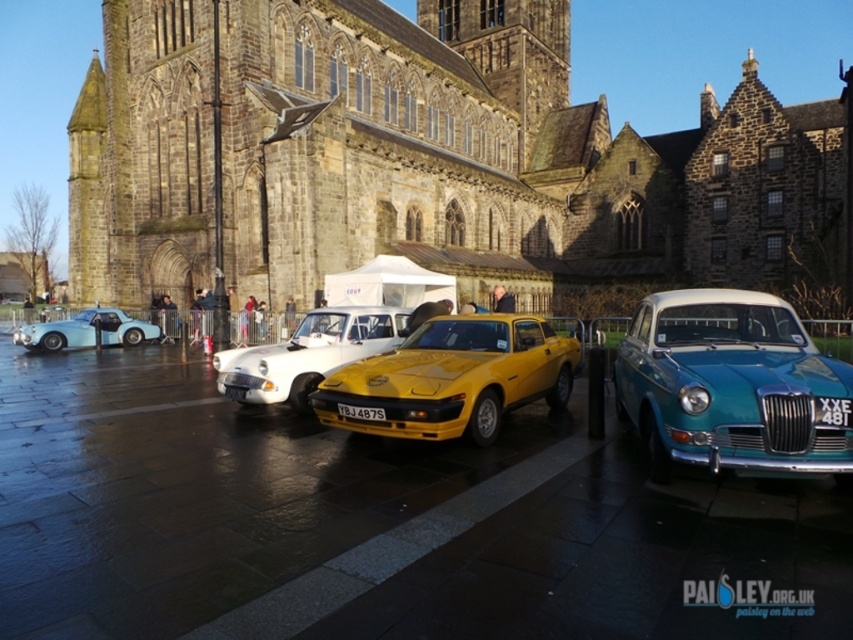
Question: Which point is closer to the camera?

Choices:
 (A) matte blue car at left
 (B) yellow matte license plate at center
 (C) yellow matte car at center

Answer: (C)

Question: Which object is farther from the camera taking this photo?

Choices:
 (A) yellow matte car at center
 (B) yellow matte sports car at center
 (C) dark stone church at center
 (D) teal metallic sedan at right

Answer: (C)

Question: Can you confirm if dark stone church at center is positioned above yellow matte sports car at center?

Choices:
 (A) yes
 (B) no

Answer: (A)

Question: Does teal metallic sedan at right have a larger size compared to yellow matte sports car at center?

Choices:
 (A) yes
 (B) no

Answer: (A)

Question: Which object appears closest to the camera in this image?

Choices:
 (A) yellow matte license plate at center
 (B) dark stone church at center
 (C) yellow matte sports car at center
 (D) yellow matte car at center

Answer: (D)

Question: Does dark stone church at center have a lesser width compared to yellow matte car at center?

Choices:
 (A) no
 (B) yes

Answer: (A)